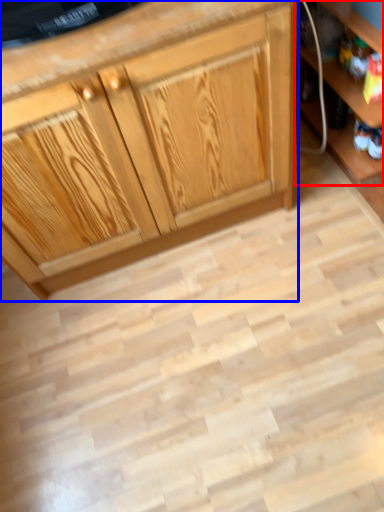
Question: Among these objects, which one is farthest to the camera, shelf (highlighted by a red box) or cabinetry (highlighted by a blue box)?

Choices:
 (A) shelf
 (B) cabinetry

Answer: (A)